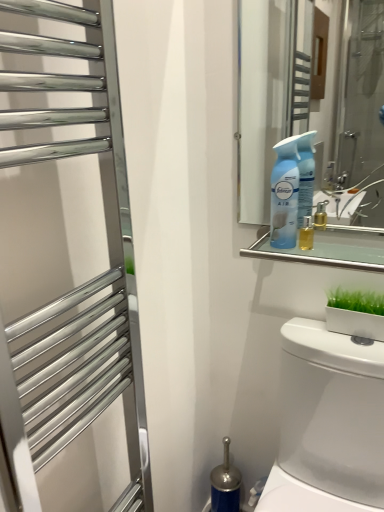
Question: Is polished chrome towel rack at left smaller than clear glass mirror at upper center?

Choices:
 (A) no
 (B) yes

Answer: (A)

Question: Can you confirm if polished chrome towel rack at left is taller than clear glass mirror at upper center?

Choices:
 (A) no
 (B) yes

Answer: (B)

Question: Would you say polished chrome towel rack at left is a long distance from clear glass mirror at upper center?

Choices:
 (A) no
 (B) yes

Answer: (A)

Question: Is polished chrome towel rack at left to the right of clear glass mirror at upper center from the viewer's perspective?

Choices:
 (A) no
 (B) yes

Answer: (A)

Question: Could you tell me if polished chrome towel rack at left is turned towards clear glass mirror at upper center?

Choices:
 (A) no
 (B) yes

Answer: (A)

Question: Is polished chrome towel rack at left in front of or behind blue plastic spray bottle at upper right in the image?

Choices:
 (A) front
 (B) behind

Answer: (A)

Question: Is polished chrome towel rack at left spatially inside blue plastic spray bottle at upper right, or outside of it?

Choices:
 (A) inside
 (B) outside

Answer: (B)

Question: Does point (1, 159) appear closer or farther from the camera than point (271, 217)?

Choices:
 (A) closer
 (B) farther

Answer: (A)

Question: From a real-world perspective, is polished chrome towel rack at left above or below blue plastic spray bottle at upper right?

Choices:
 (A) below
 (B) above

Answer: (A)

Question: Is clear glass mirror at upper center bigger or smaller than green matte planter at lower right?

Choices:
 (A) big
 (B) small

Answer: (A)

Question: From a real-world perspective, is clear glass mirror at upper center above or below green matte planter at lower right?

Choices:
 (A) below
 (B) above

Answer: (B)

Question: Is clear glass mirror at upper center wider or thinner than green matte planter at lower right?

Choices:
 (A) thin
 (B) wide

Answer: (B)

Question: Do you think clear glass mirror at upper center is within green matte planter at lower right, or outside of it?

Choices:
 (A) outside
 (B) inside

Answer: (A)

Question: Relative to white glossy toilet at lower right, is polished chrome towel rack at left in front or behind?

Choices:
 (A) front
 (B) behind

Answer: (A)

Question: Does point (84, 384) appear closer or farther from the camera than point (354, 442)?

Choices:
 (A) farther
 (B) closer

Answer: (B)